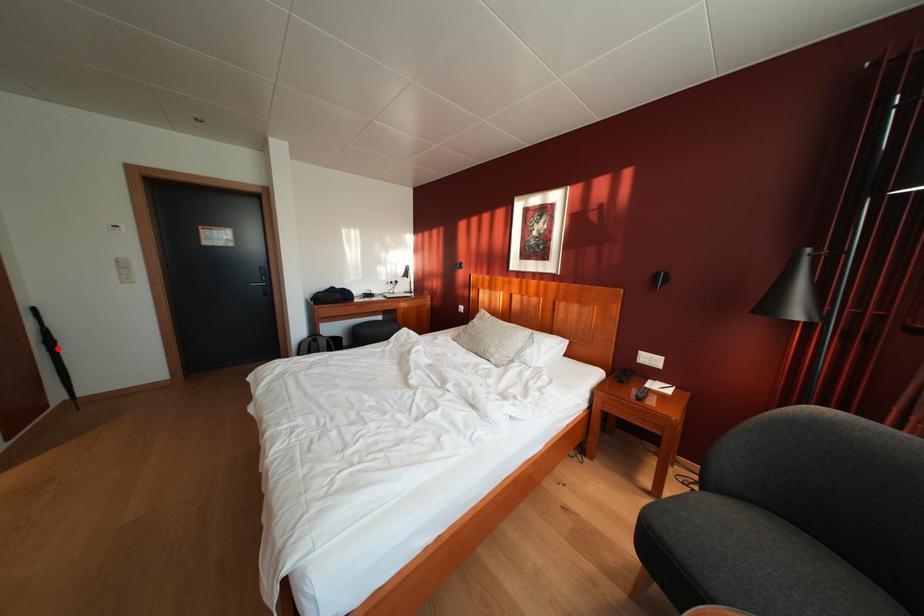
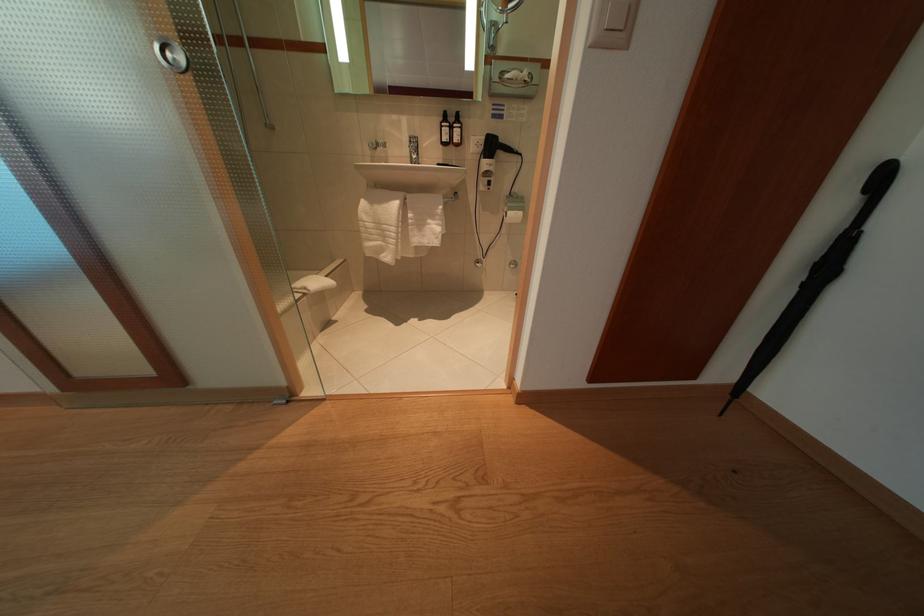
Question: I am providing you with two images of the same scene from different viewpoints. A red point is shown in image1. For the corresponding object point in image2, is it positioned nearer or farther from the camera?

Choices:
 (A) Nearer
 (B) Farther

Answer: (A)